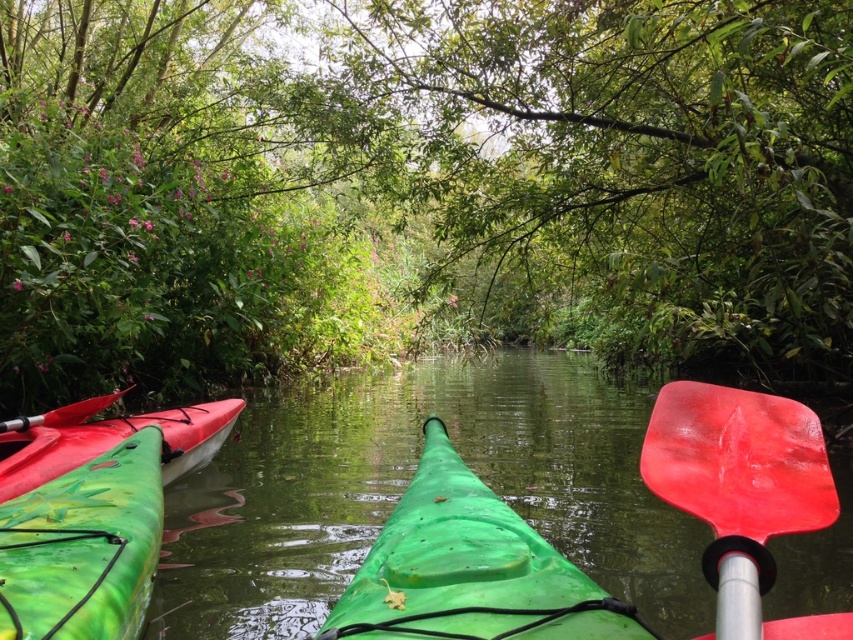
You are kayaking on a narrow canal and need to navigate through a gap between two trees. You see the red matte paddle at center and the green matte kayak at left. Which object is narrower and can fit through the gap more easily?

The red matte paddle at center is thinner than the green matte kayak at left, so it can fit through the gap more easily.

You are kayaking down a narrow canal and want to navigate between two points marked as point (625, 413) and point (59, 572). Which point is closer to your current position in the kayak?

Point (59, 572) is closer to your current position in the kayak because it is less further to the viewer than point (625, 413).

You are navigating a narrow waterway and see the green plastic kayak at center and the green matte kayak at lower left. Which kayak is closer to you?

The green plastic kayak at center is closer to you because it is positioned further to the viewer than the green matte kayak at lower left, which is farther away.